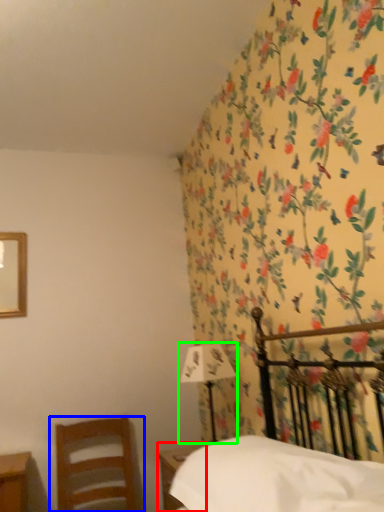
Question: Which object is the farthest from nightstand (highlighted by a red box)? Choose among these: chair (highlighted by a blue box) or bedside lamp (highlighted by a green box).

Choices:
 (A) chair
 (B) bedside lamp

Answer: (A)